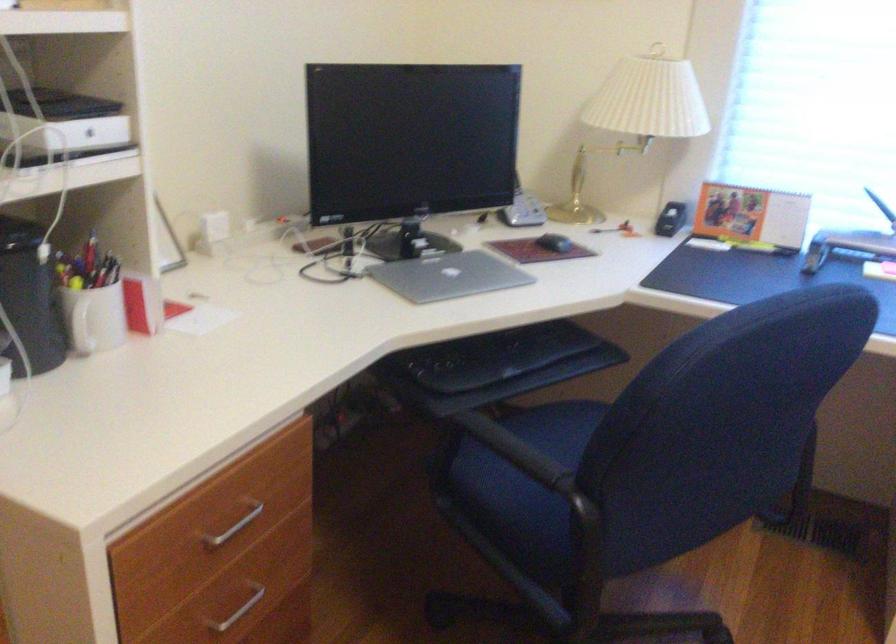
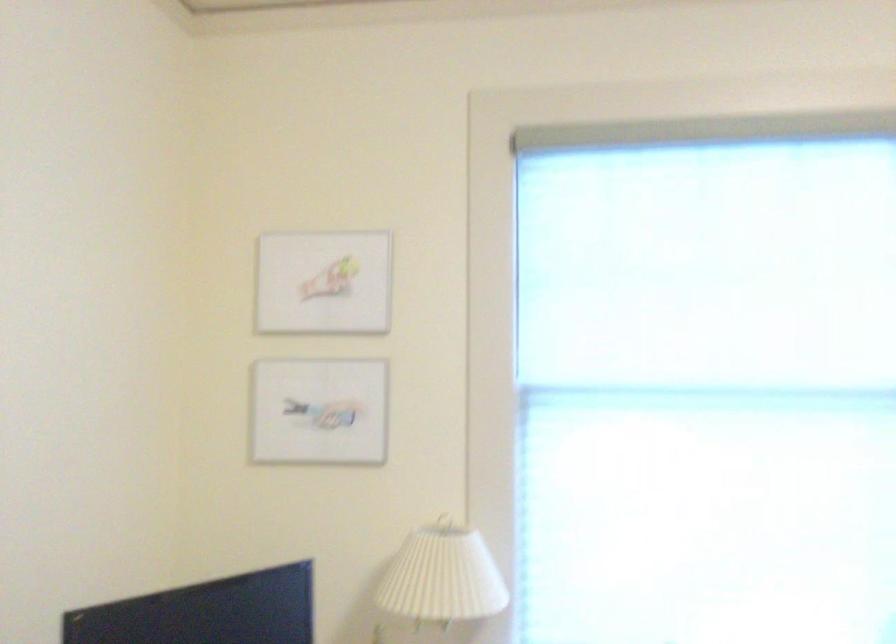
How did the camera likely rotate?

The camera's rotation is toward right-up.